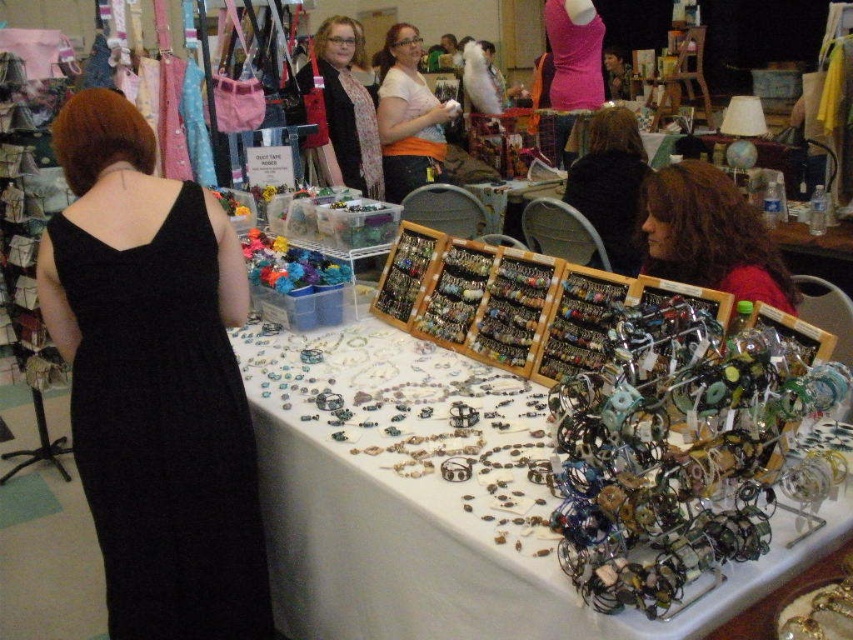
Question: Is metallic wire bracelets at center to the right of matte black hair at center from the viewer's perspective?

Choices:
 (A) no
 (B) yes

Answer: (A)

Question: From the image, what is the correct spatial relationship of white fabric tablecloth at center in relation to metallic wire bracelets at center?

Choices:
 (A) left
 (B) right

Answer: (A)

Question: Which of these objects is positioned farthest from the white fabric tablecloth at center?

Choices:
 (A) matte black scarf at center
 (B) metallic wire bracelets at center

Answer: (A)

Question: Which object is the closest to the white matte shirt at center?

Choices:
 (A) white fabric tablecloth at center
 (B) matte black scarf at center
 (C) matte black hair at center
 (D) black satin dress at left

Answer: (B)

Question: Does white fabric tablecloth at center come in front of black satin dress at left?

Choices:
 (A) no
 (B) yes

Answer: (B)

Question: Among these objects, which one is farthest from the camera?

Choices:
 (A) black satin dress at left
 (B) shiny brown hair at center

Answer: (B)